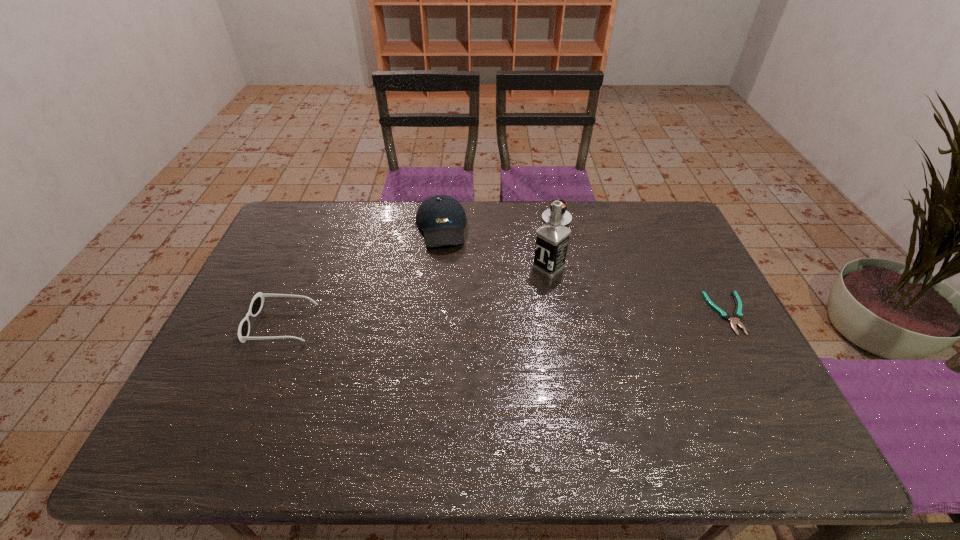
In order to click on free space on the desktop that is between the sunglasses and the pliers and is positioned on the front label of the third farthest object in this screenshot , I will do `click(486, 319)`.

Find the location of a particular element. The height and width of the screenshot is (540, 960). free space on the desktop that is between the sunglasses and the shortest object and is positioned with the handle on the side of the cappuccino is located at coordinates (566, 318).

Identify the location of free spot on the desktop that is between the leftmost object and the pliers and is positioned on the front-facing side of the baseball cap. The height and width of the screenshot is (540, 960). (455, 320).